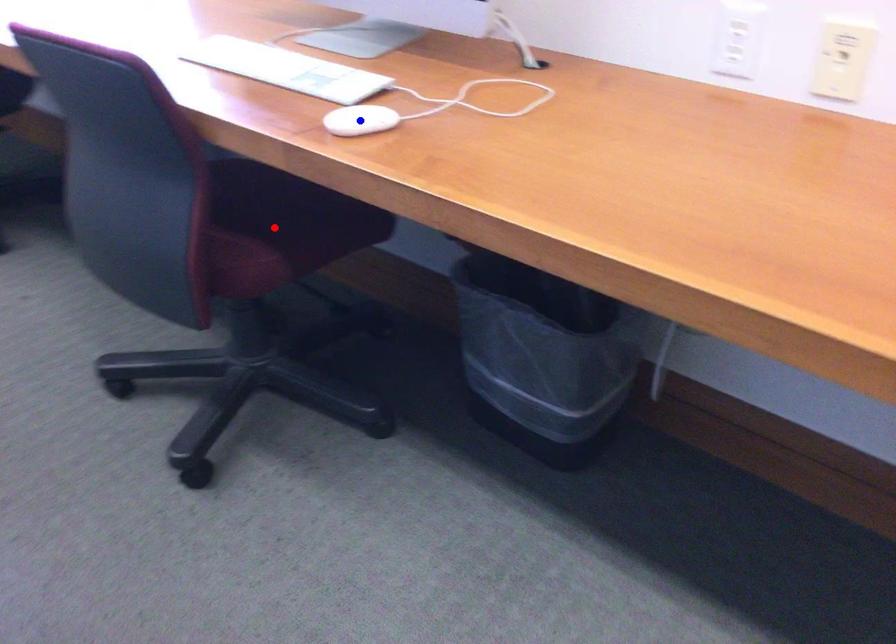
Question: Which of the two points in the image is closer to the camera?

Choices:
 (A) Blue point is closer.
 (B) Red point is closer.

Answer: (A)